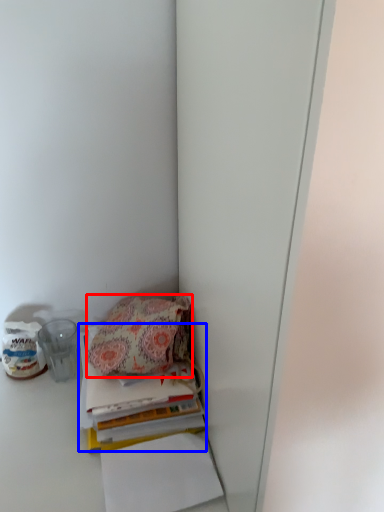
Question: Which of the following is the farthest to the observer, handbag (highlighted by a red box) or paperback book (highlighted by a blue box)?

Choices:
 (A) handbag
 (B) paperback book

Answer: (A)